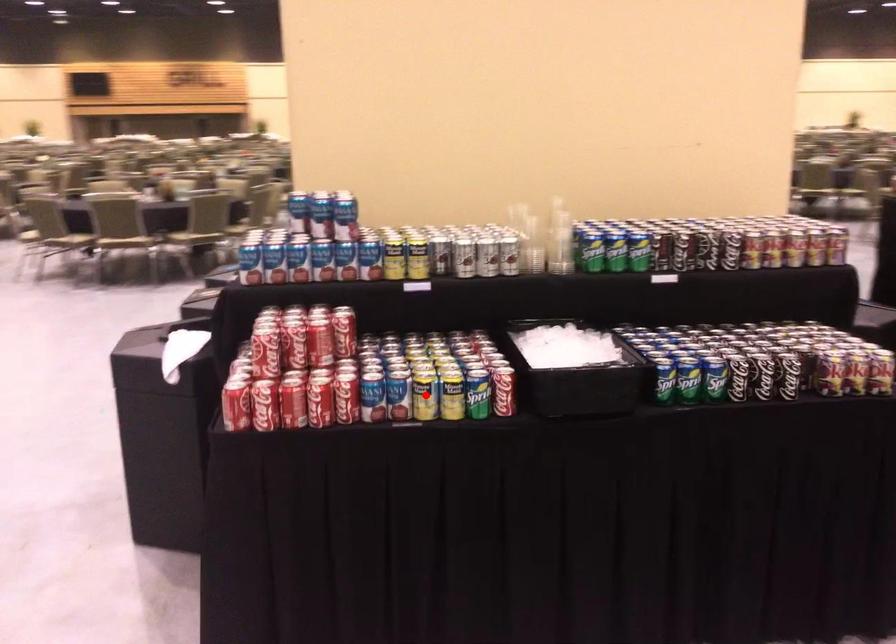
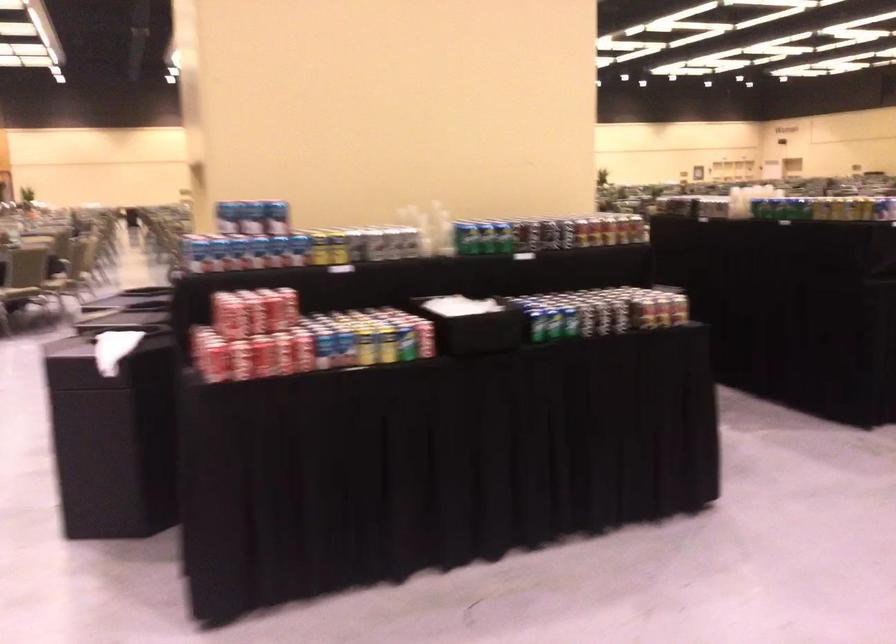
Question: I am providing you with two images of the same scene from different viewpoints. In image1, a red point is highlighted. Considering the same 3D point in image2, which of the following is correct?

Choices:
 (A) It is closer
 (B) It is farther

Answer: (B)